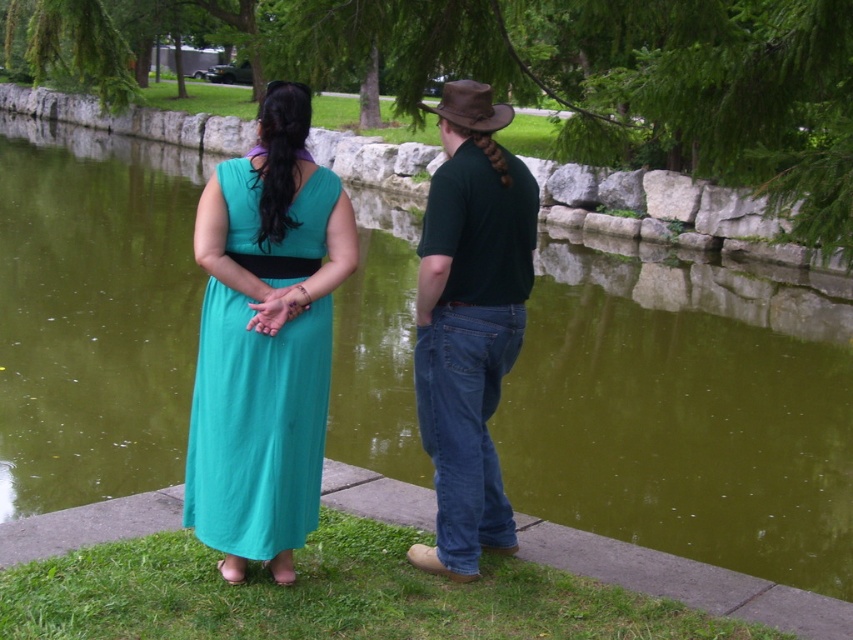
Question: Which object appears closest to the camera in this image?

Choices:
 (A) dark green cotton shirt at center
 (B) brown leather cowboy hat at upper center
 (C) teal fabric dress at center
 (D) matte green dress at center

Answer: (D)

Question: From the image, what is the correct spatial relationship of matte green dress at center in relation to dark green cotton shirt at center?

Choices:
 (A) right
 (B) left

Answer: (B)

Question: Does matte green dress at center come in front of teal fabric dress at center?

Choices:
 (A) yes
 (B) no

Answer: (A)

Question: Which of the following is the farthest from the observer?

Choices:
 (A) (276, 428)
 (B) (227, 369)

Answer: (A)

Question: Does matte green dress at center appear under teal fabric dress at center?

Choices:
 (A) no
 (B) yes

Answer: (A)

Question: Considering the real-world distances, which object is farthest from the teal fabric dress at center?

Choices:
 (A) brown leather cowboy hat at upper center
 (B) matte green dress at center

Answer: (A)